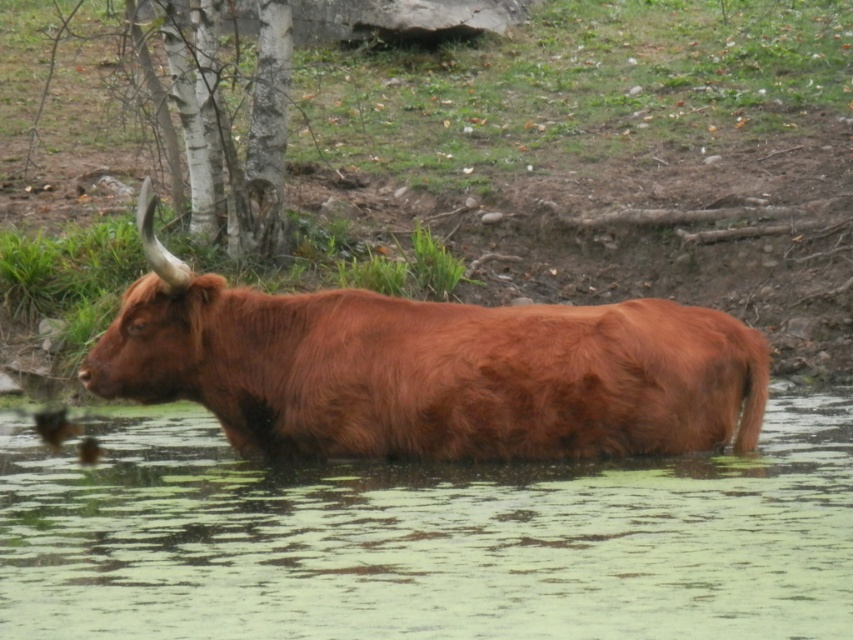
Question: Does green algae water at lower center appear on the left side of bark textured tree at upper left?

Choices:
 (A) yes
 (B) no

Answer: (B)

Question: Can you confirm if green algae water at lower center is wider than bark textured tree at upper left?

Choices:
 (A) no
 (B) yes

Answer: (B)

Question: Which of the following is the closest to the observer?

Choices:
 (A) green algae water at lower center
 (B) brown furry yak at center
 (C) bark textured tree at upper left

Answer: (A)

Question: Which object appears farthest from the camera in this image?

Choices:
 (A) bark textured tree at upper left
 (B) brown furry yak at center
 (C) green algae water at lower center

Answer: (A)

Question: Which of the following is the farthest from the observer?

Choices:
 (A) brown furry yak at center
 (B) green algae water at lower center

Answer: (A)

Question: From the image, what is the correct spatial relationship of green algae water at lower center in relation to brown furry yak at center?

Choices:
 (A) below
 (B) above

Answer: (A)